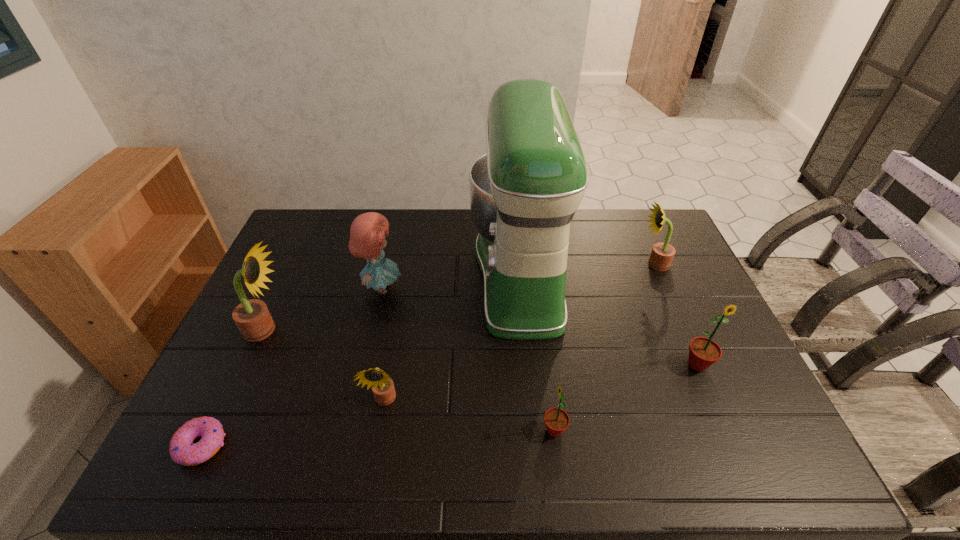
Where is `green mixer`? The width and height of the screenshot is (960, 540). green mixer is located at coordinates [x=524, y=192].

Where is `mixer`? mixer is located at coordinates (524, 192).

The image size is (960, 540). Identify the location of the second nearest yellow sunflower. (252, 317).

Image resolution: width=960 pixels, height=540 pixels. In order to click on the leftmost yellow sunflower in this screenshot , I will do `click(252, 317)`.

Image resolution: width=960 pixels, height=540 pixels. Identify the location of doll. (368, 231).

Where is `the farthest sunflower`? This screenshot has width=960, height=540. the farthest sunflower is located at coordinates (662, 254).

This screenshot has width=960, height=540. What are the coordinates of `the second biggest yellow sunflower` in the screenshot? It's located at (662, 254).

I want to click on the fourth nearest object, so click(703, 352).

I want to click on the bigger green sunflower, so click(x=703, y=352).

The image size is (960, 540). Identify the location of the smaller green sunflower. (556, 420).